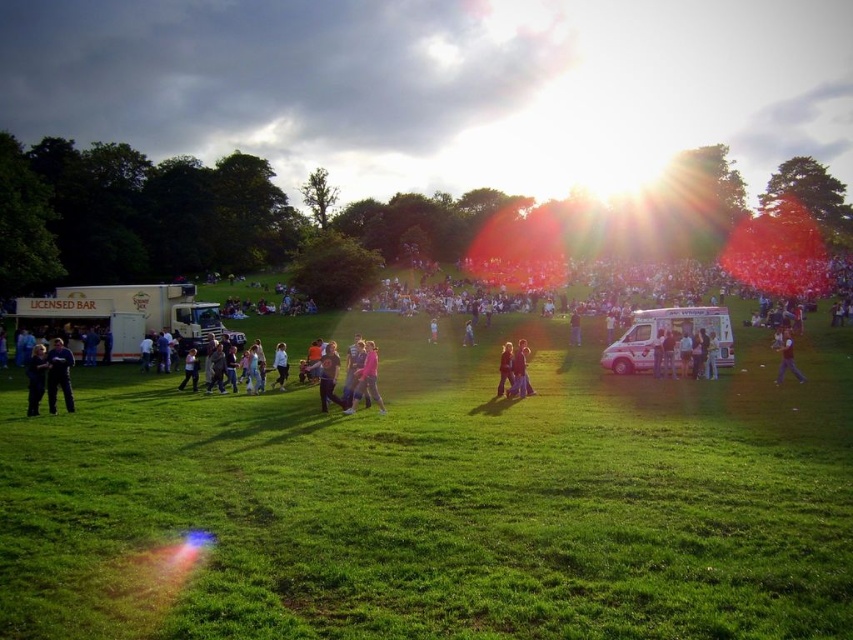
You are standing at the point labeled point (575, 326) and want to walk to the white van labeled Licensed Bar. There is a point labeled point (506, 368) between you and the van. Is this point in front of you or behind you?

The point labeled point (506, 368) is in front of you because it is in front of point (575, 326), which is your current position.